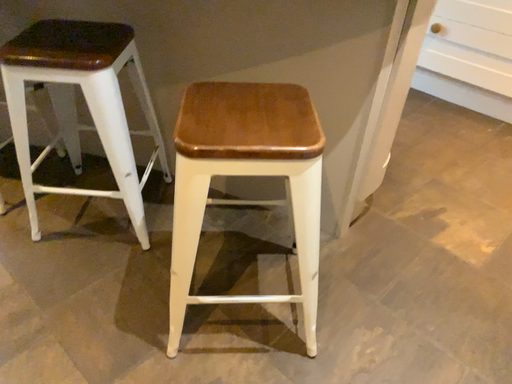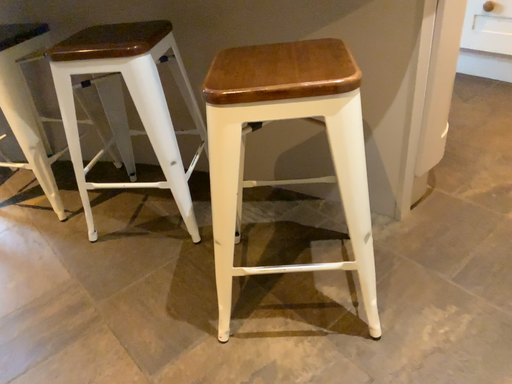
Question: Which way did the camera rotate in the video?

Choices:
 (A) rotated left
 (B) rotated right

Answer: (A)